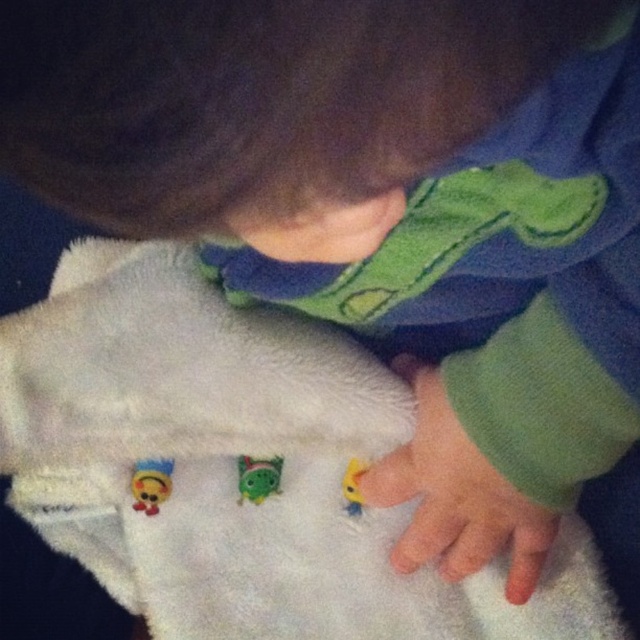
You are a photographer adjusting your camera focus. You need to focus on two points in the image, point (276, 493) and point (147, 490). Which point is closer to the camera lens?

Point (276, 493) is further to the viewer than point (147, 490), so point (147, 490) is closer to the camera lens.

Based on the scene description, where is the smooth green hand at lower center positioned in relation to the towel?

The smooth green hand at lower center is positioned at the bottom right corner of the towel.